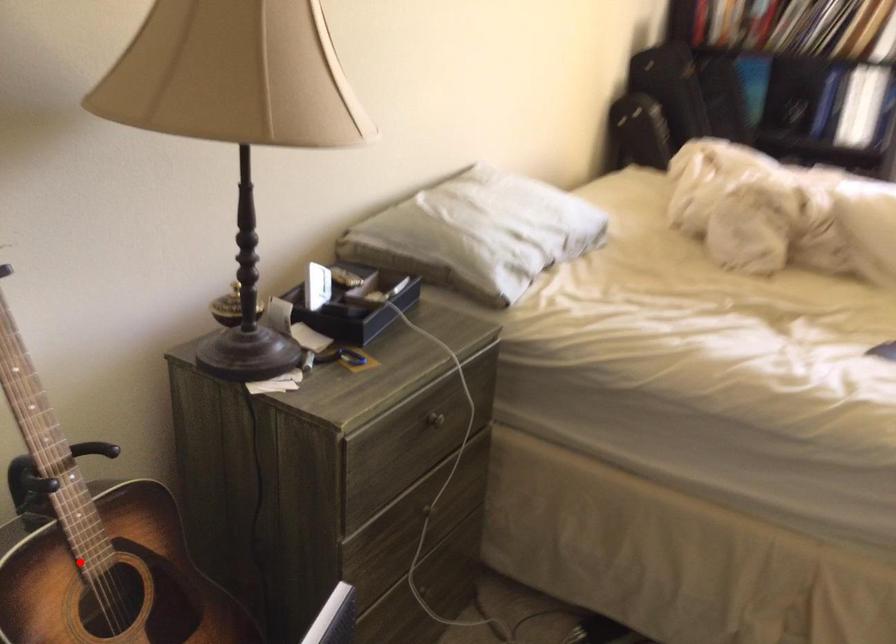
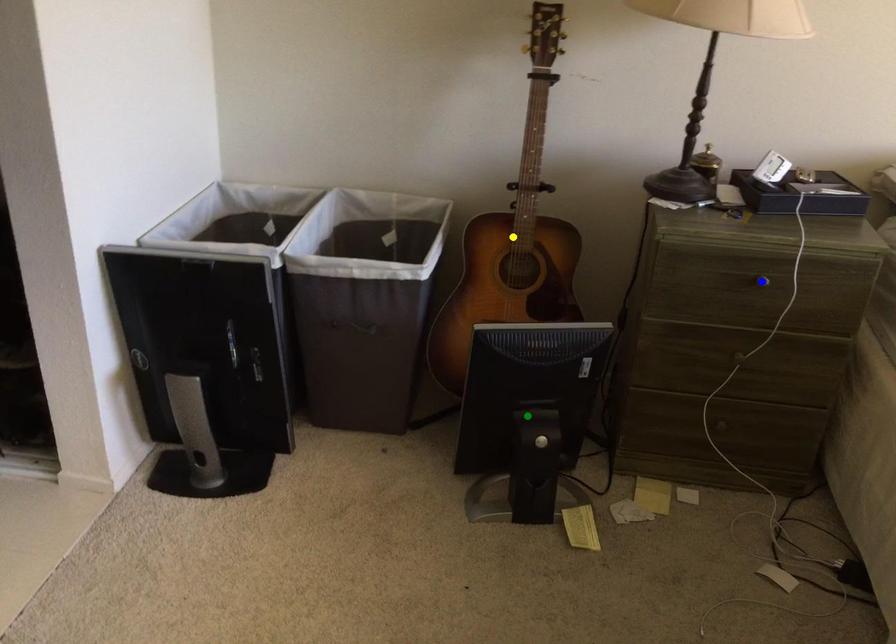
Question: I am providing you with two images of the same scene from different viewpoints. A red point is marked on the first image. You are given multiple points on the second image. Which mark in image 2 goes with the point in image 1?

Choices:
 (A) yellow point
 (B) blue point
 (C) green point

Answer: (A)